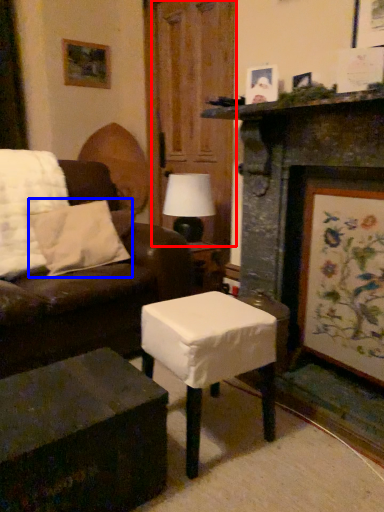
Question: Which object is closer to the camera taking this photo, glass door (highlighted by a red box) or pillow (highlighted by a blue box)?

Choices:
 (A) glass door
 (B) pillow

Answer: (B)